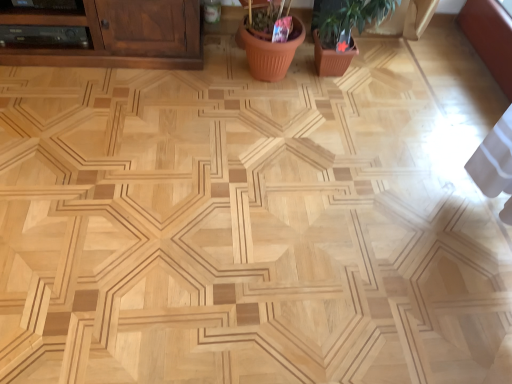
Find the location of a particular element. This screenshot has width=512, height=384. brown wood cabinet at upper left is located at coordinates (103, 34).

Describe the element at coordinates (103, 34) in the screenshot. I see `brown wood cabinet at upper left` at that location.

Where is `brown wood cabinet at upper left`? This screenshot has width=512, height=384. brown wood cabinet at upper left is located at coordinates (103, 34).